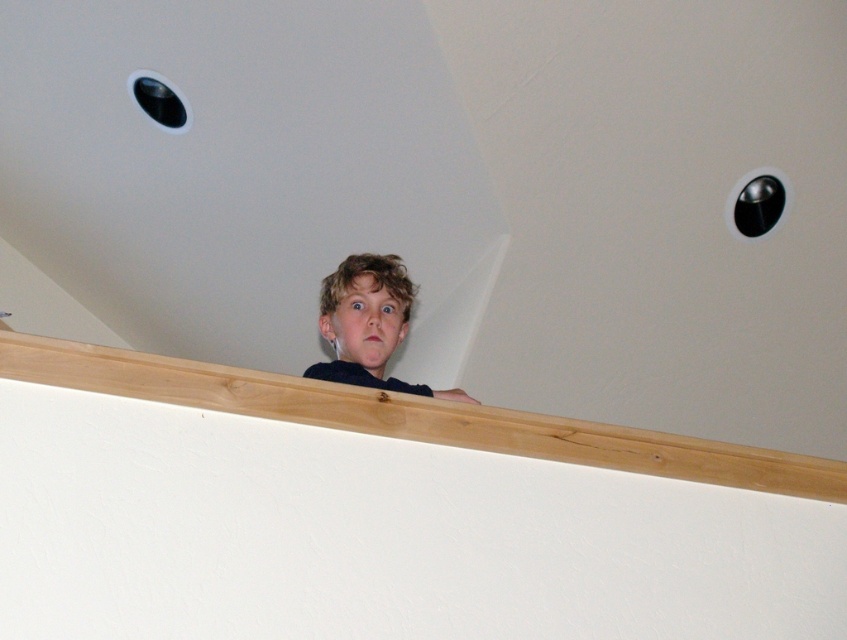
Which is in front, point (767, 179) or point (162, 106)?

Positioned in front is point (162, 106).

Does metallic circular hole at upper right have a lesser width compared to black plastic hole at upper left?

Yes.

Which is behind, point (774, 177) or point (158, 88)?

Point (774, 177)

Where is `metallic circular hole at upper right`? metallic circular hole at upper right is located at coordinates (757, 205).

Is light brown wood at upper center to the left of metallic circular hole at upper right from the viewer's perspective?

Yes, light brown wood at upper center is to the left of metallic circular hole at upper right.

Does point (543, 429) come farther from viewer compared to point (782, 188)?

No, it is not.

Is point (153, 372) positioned after point (756, 204)?

No, (153, 372) is in front of (756, 204).

Image resolution: width=847 pixels, height=640 pixels. Find the location of `light brown wood at upper center`. light brown wood at upper center is located at coordinates (413, 417).

Is light brown wood at upper center closer to camera compared to black plastic hole at upper left?

Yes, it is.

Between point (331, 403) and point (151, 81), which one is positioned in front?

Point (331, 403)

Between point (502, 410) and point (178, 116), which one is positioned behind?

The point (178, 116) is more distant.

You are a GUI agent. You are given a task and a screenshot of the screen. Output one action in this format:
    pyautogui.click(x=<x>, y=<y>)
    Task: Click on the light brown wood at upper center
    The width and height of the screenshot is (847, 640).
    Given the screenshot: What is the action you would take?
    pyautogui.click(x=413, y=417)